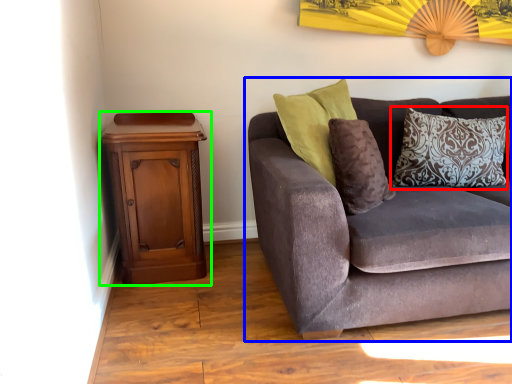
Question: Based on their relative distances, which object is farther from pillow (highlighted by a red box)? Choose from studio couch (highlighted by a blue box) and nightstand (highlighted by a green box).

Choices:
 (A) studio couch
 (B) nightstand

Answer: (B)